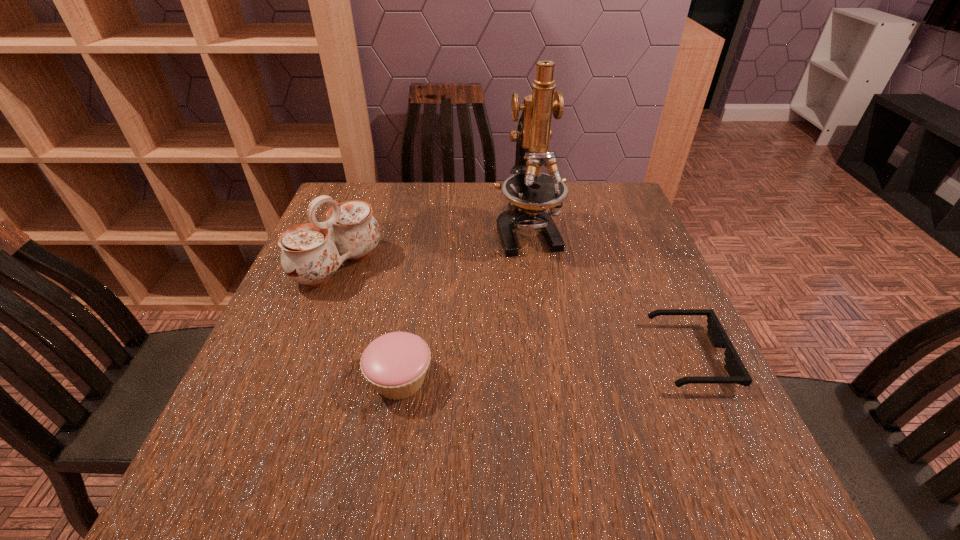
This screenshot has width=960, height=540. I want to click on vacant region located by the handle of the third shortest object, so click(389, 299).

The width and height of the screenshot is (960, 540). What are the coordinates of `free region located 0.090m by the handle of the third shortest object` in the screenshot? It's located at (392, 301).

I want to click on vacant space located 0.080m at the eyepiece of the second object from right to left, so [544, 284].

Identify the location of vacant space located at the eyepiece of the second object from right to left. This screenshot has height=540, width=960. (545, 286).

Identify the location of blank space located at the eyepiece of the second object from right to left. This screenshot has width=960, height=540. (557, 314).

This screenshot has height=540, width=960. I want to click on object that is at the far edge, so click(x=530, y=192).

Identify the location of object that is positioned at the near edge. (395, 364).

The image size is (960, 540). I want to click on object present at the left edge, so click(311, 253).

The image size is (960, 540). I want to click on object that is at the right edge, so click(x=734, y=366).

Image resolution: width=960 pixels, height=540 pixels. I want to click on free space at the far edge of the desktop, so click(x=438, y=203).